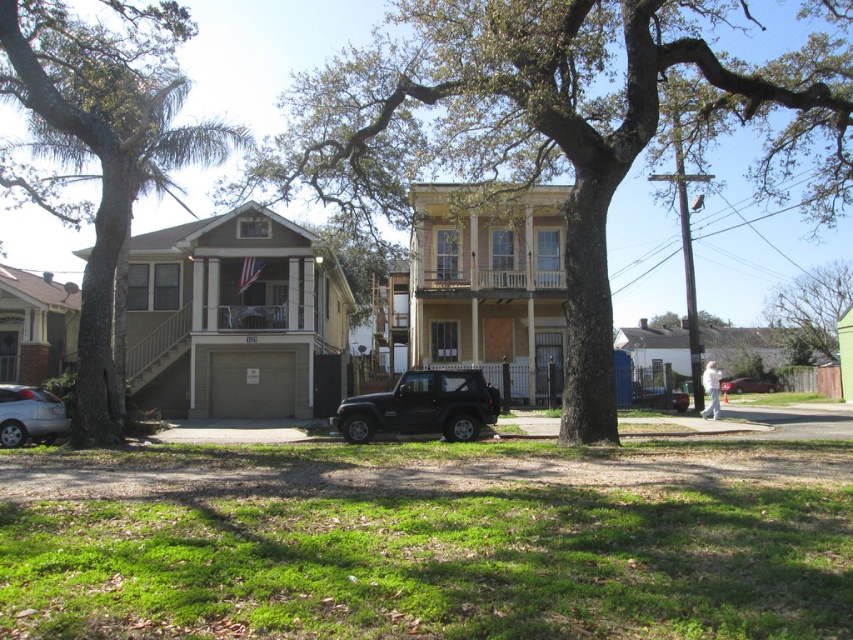
Question: Which point appears farthest from the camera in this image?

Choices:
 (A) (486, 388)
 (B) (51, 406)

Answer: (A)

Question: Among these objects, which one is farthest from the camera?

Choices:
 (A) green leafy tree at left
 (B) black matte suv at center
 (C) green leafy tree at upper right

Answer: (C)

Question: Is black matte suv at center above silver metallic sedan at lower left?

Choices:
 (A) no
 (B) yes

Answer: (A)

Question: Does brown textured tree at center lie in front of green leafy tree at upper right?

Choices:
 (A) no
 (B) yes

Answer: (B)

Question: Among these objects, which one is nearest to the camera?

Choices:
 (A) green leafy tree at upper right
 (B) brown textured tree at center

Answer: (B)

Question: Is brown textured tree at center positioned at the back of metallic silver car at center?

Choices:
 (A) no
 (B) yes

Answer: (A)